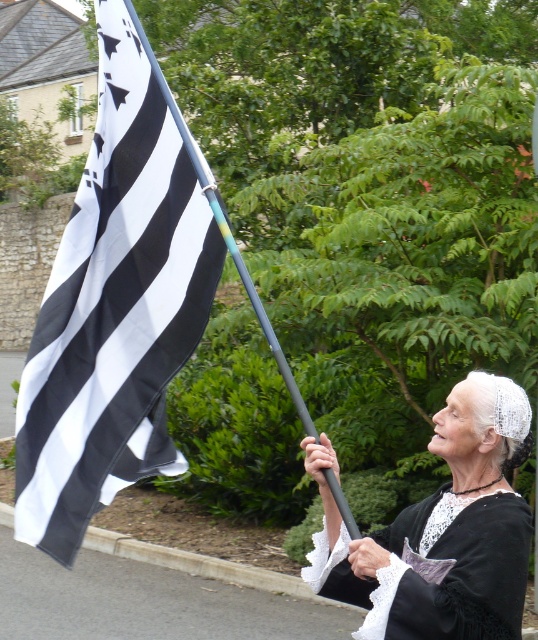
Question: Does white lace dress at center lie behind black plastic pole at upper left?

Choices:
 (A) no
 (B) yes

Answer: (A)

Question: Which of the following is the farthest from the observer?

Choices:
 (A) (336, 481)
 (B) (67, 436)

Answer: (B)

Question: Is black and white striped flag at upper left closer to the viewer compared to black plastic pole at upper left?

Choices:
 (A) no
 (B) yes

Answer: (A)

Question: Which point appears closest to the camera in this image?

Choices:
 (A) (160, 120)
 (B) (315, 468)

Answer: (B)

Question: Is white lace dress at center to the right of black plastic pole at upper left from the viewer's perspective?

Choices:
 (A) no
 (B) yes

Answer: (B)

Question: Which object is the farthest from the black and white striped flag at upper left?

Choices:
 (A) black plastic pole at upper left
 (B) white lace dress at center

Answer: (B)